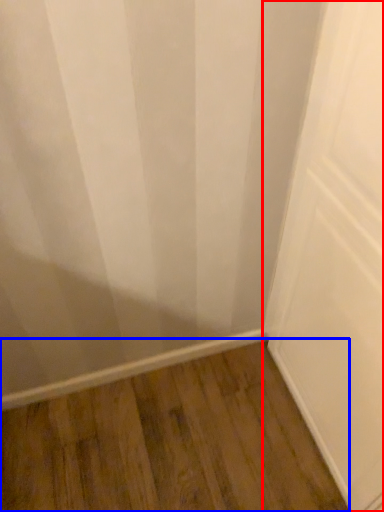
Question: Which object is closer to the camera taking this photo, door (highlighted by a red box) or hardwood (highlighted by a blue box)?

Choices:
 (A) door
 (B) hardwood

Answer: (A)